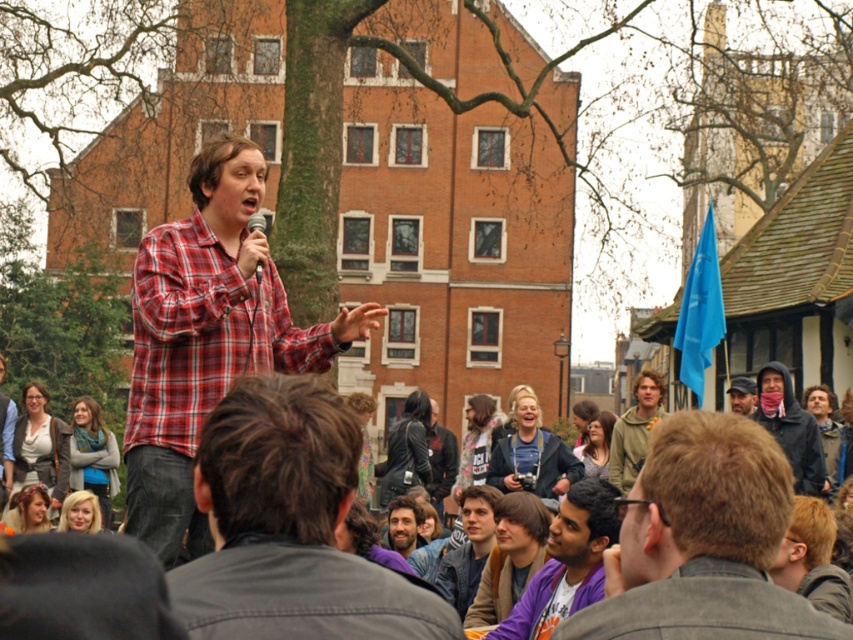
You are a photographer trying to capture a clear shot of the plaid shirt at center and the denim jacket at lower left. Since you want both subjects to be in focus, which one should you focus on first to ensure the other is also sharp?

The plaid shirt at center is in front of the denim jacket at lower left. To ensure both are in focus, you should focus on the plaid shirt at center first, as it is closer to the camera. This will allow the denim jacket at lower left, which is further back, to remain in focus as well.

You are standing at the point labeled point (x=19, y=531). The speaker is 107.30 meters away from you. If you want to move closer to the speaker by 20 meters, how far will you be from the speaker then?

After moving 20 meters closer, you will be 87.30 meters away from the speaker.

You are a photographer trying to capture a closeup of the floral headband at lower left and the matte black microphone at center. Which object should you zoom in on to ensure it appears larger in your photo?

The matte black microphone at center should be zoomed in on because it is thicker than the floral headband at lower left, making it easier to capture a larger image.